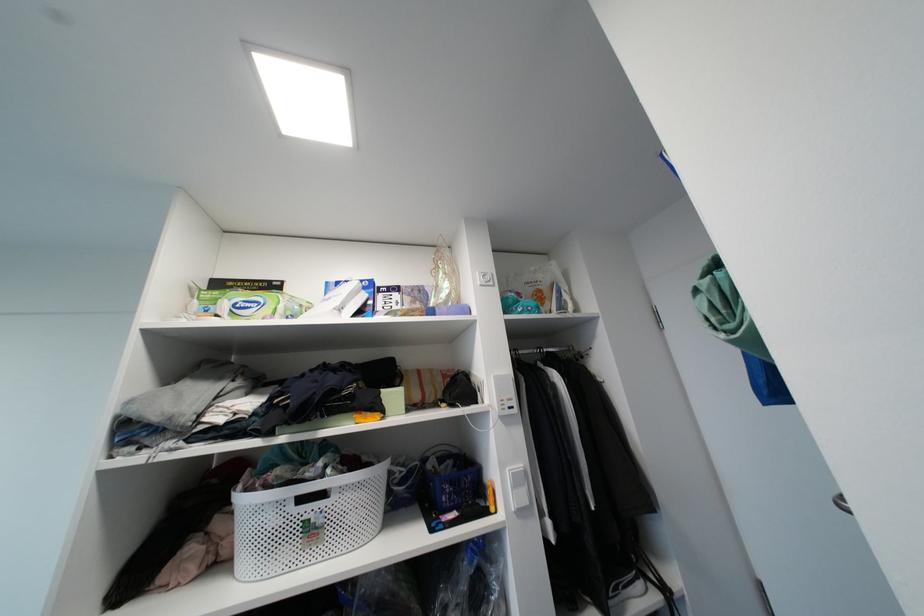
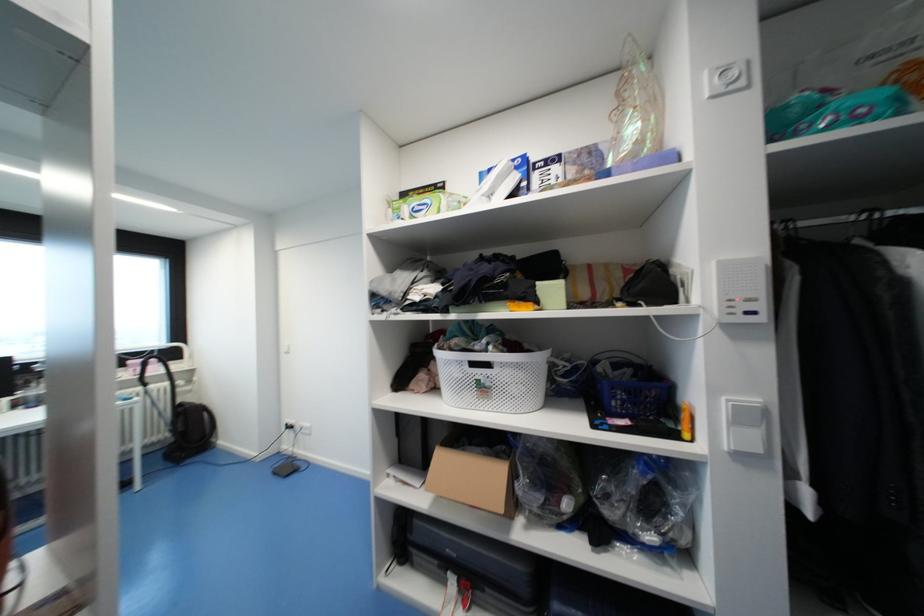
Locate, in the second image, the point that corresponds to (550,351) in the first image.

(895, 214)